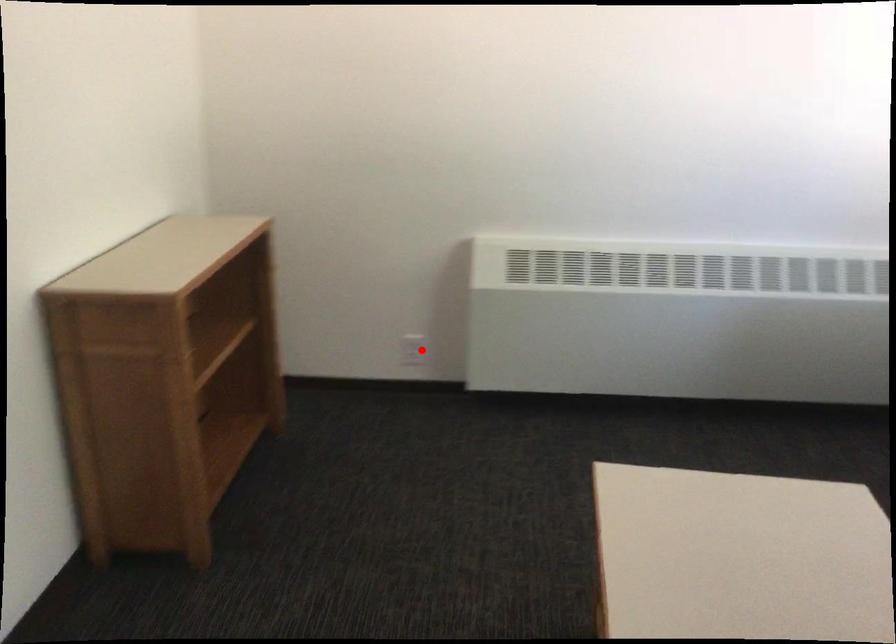
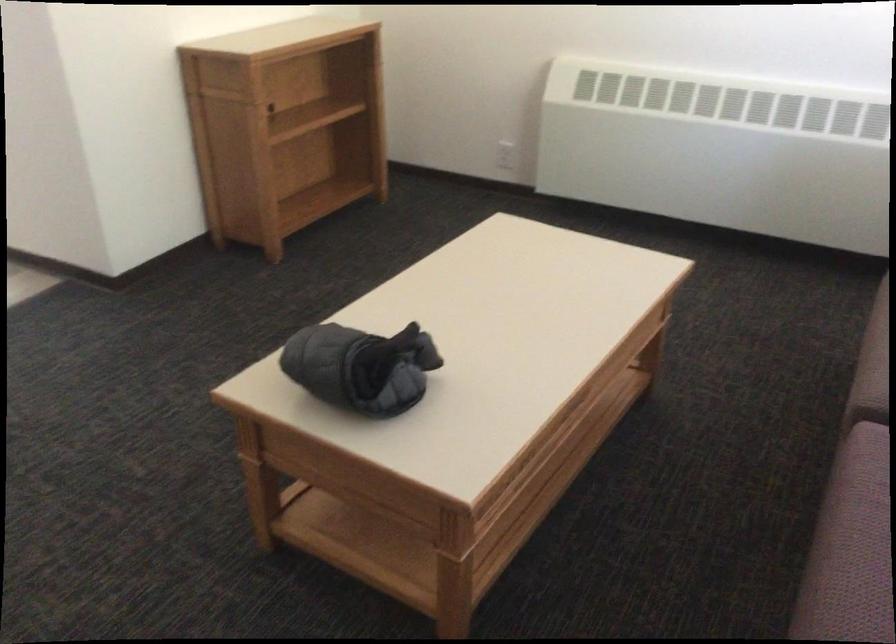
Where in the second image is the point corresponding to the highlighted location from the first image?

(505, 155)